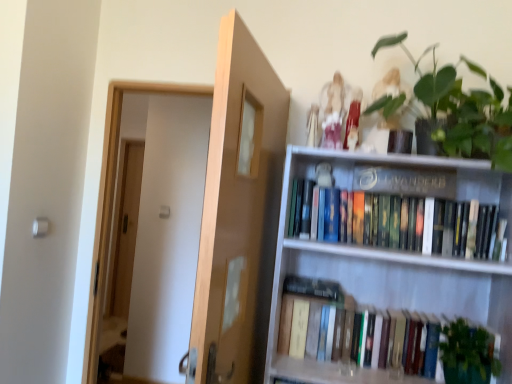
Question: Can you confirm if green matte plant at upper right is positioned to the left of green leafy plant at lower right?

Choices:
 (A) no
 (B) yes

Answer: (B)

Question: Can you confirm if green matte plant at upper right is shorter than green leafy plant at lower right?

Choices:
 (A) no
 (B) yes

Answer: (A)

Question: Does green matte plant at upper right have a larger size compared to green leafy plant at lower right?

Choices:
 (A) no
 (B) yes

Answer: (B)

Question: Considering the relative positions of green matte plant at upper right and green leafy plant at lower right in the image provided, is green matte plant at upper right in front of green leafy plant at lower right?

Choices:
 (A) no
 (B) yes

Answer: (B)

Question: Would you say green matte plant at upper right contains green leafy plant at lower right?

Choices:
 (A) yes
 (B) no

Answer: (B)

Question: Is green matte plant at upper right aimed at green leafy plant at lower right?

Choices:
 (A) no
 (B) yes

Answer: (A)

Question: Could matte white statue at upper center be considered to be inside green matte plant at upper right?

Choices:
 (A) yes
 (B) no

Answer: (B)

Question: Is green matte plant at upper right positioned before matte white statue at upper center?

Choices:
 (A) no
 (B) yes

Answer: (B)

Question: Is green matte plant at upper right further to camera compared to matte white statue at upper center?

Choices:
 (A) no
 (B) yes

Answer: (A)

Question: From a real-world perspective, is green matte plant at upper right positioned under matte white statue at upper center based on gravity?

Choices:
 (A) yes
 (B) no

Answer: (B)

Question: Does green matte plant at upper right have a larger size compared to matte white statue at upper center?

Choices:
 (A) no
 (B) yes

Answer: (B)

Question: Is green matte plant at upper right smaller than matte white statue at upper center?

Choices:
 (A) yes
 (B) no

Answer: (B)

Question: Considering the relative sizes of hardcover books at upper right, which appears as the 1th book when viewed from the top, and hardcover books at lower right, which is the second book from top to bottom, in the image provided, is hardcover books at upper right, which appears as the 1th book when viewed from the top, smaller than hardcover books at lower right, which is the second book from top to bottom,?

Choices:
 (A) no
 (B) yes

Answer: (B)